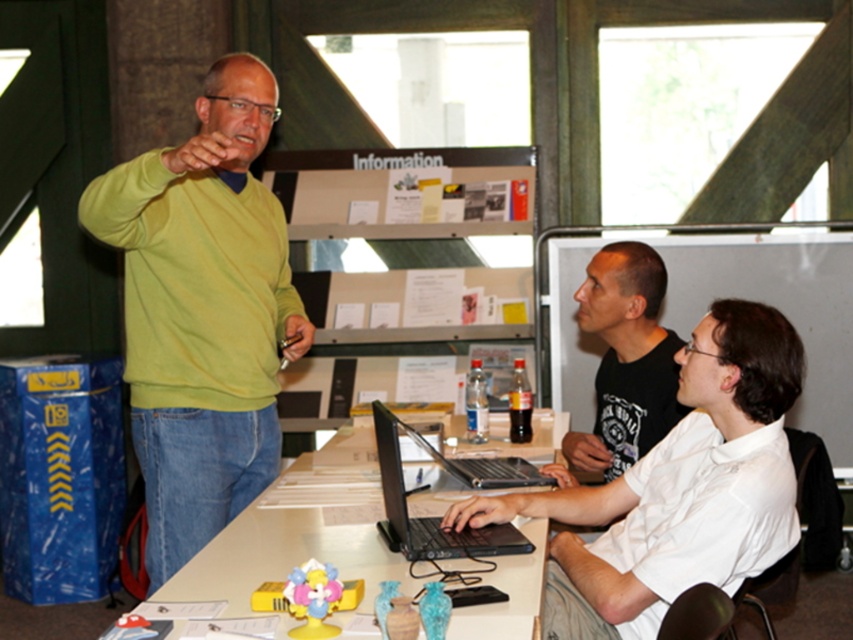
Does white glossy table at center lie behind black plastic laptop at center?

No, it is not.

Does point (236, 548) come behind point (450, 474)?

No, it is not.

The image size is (853, 640). I want to click on white glossy table at center, so click(x=292, y=540).

Between green matte sweater at upper left and white glossy table at center, which one is positioned lower?

Positioned lower is white glossy table at center.

Can you confirm if green matte sweater at upper left is positioned below white glossy table at center?

Incorrect, green matte sweater at upper left is not positioned below white glossy table at center.

What are the coordinates of `green matte sweater at upper left` in the screenshot? It's located at (202, 312).

Can you confirm if black matte shirt at center is smaller than black matte laptop at center?

No, black matte shirt at center is not smaller than black matte laptop at center.

Is the position of black matte shirt at center less distant than that of black matte laptop at center?

That is False.

Who is more distant from viewer, (625, 296) or (480, 465)?

The point (625, 296) is behind.

The width and height of the screenshot is (853, 640). What are the coordinates of `black matte shirt at center` in the screenshot? It's located at (625, 358).